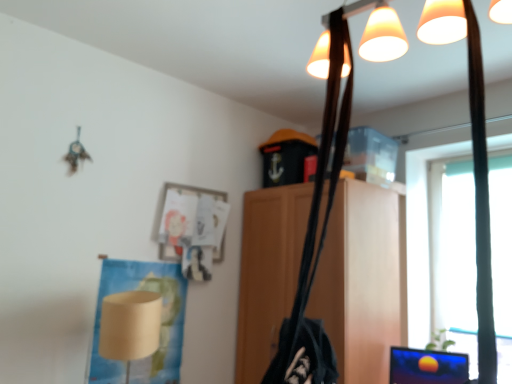
Question: Are wooden cabinet at center and transparent plastic window screen at right located far from each other?

Choices:
 (A) no
 (B) yes

Answer: (A)

Question: Is wooden cabinet at center to the left of transparent plastic window screen at right from the viewer's perspective?

Choices:
 (A) yes
 (B) no

Answer: (A)

Question: From a real-world perspective, does wooden cabinet at center stand above transparent plastic window screen at right?

Choices:
 (A) yes
 (B) no

Answer: (B)

Question: Is wooden cabinet at center located outside transparent plastic window screen at right?

Choices:
 (A) no
 (B) yes

Answer: (B)

Question: From the image's perspective, would you say wooden cabinet at center is positioned over transparent plastic window screen at right?

Choices:
 (A) no
 (B) yes

Answer: (A)

Question: Looking at the image, does beige paper lampshade at lower left seem bigger or smaller compared to transparent plastic window screen at right?

Choices:
 (A) big
 (B) small

Answer: (A)

Question: Is beige paper lampshade at lower left to the left or to the right of transparent plastic window screen at right in the image?

Choices:
 (A) left
 (B) right

Answer: (A)

Question: Choose the correct answer: Is beige paper lampshade at lower left inside transparent plastic window screen at right or outside it?

Choices:
 (A) outside
 (B) inside

Answer: (A)

Question: Is beige paper lampshade at lower left in front of or behind transparent plastic window screen at right in the image?

Choices:
 (A) behind
 (B) front

Answer: (B)

Question: Visually, is wooden cabinet at center positioned to the left or to the right of transparent plastic window screen at right?

Choices:
 (A) right
 (B) left

Answer: (B)

Question: From the image's perspective, is wooden cabinet at center above or below transparent plastic window screen at right?

Choices:
 (A) above
 (B) below

Answer: (B)

Question: Relative to transparent plastic window screen at right, is wooden cabinet at center in front or behind?

Choices:
 (A) front
 (B) behind

Answer: (A)

Question: Choose the correct answer: Is wooden cabinet at center inside transparent plastic window screen at right or outside it?

Choices:
 (A) outside
 (B) inside

Answer: (A)

Question: Is point (357, 190) closer or farther from the camera than point (144, 352)?

Choices:
 (A) farther
 (B) closer

Answer: (A)

Question: In terms of height, does wooden cabinet at center look taller or shorter compared to beige paper lampshade at lower left?

Choices:
 (A) short
 (B) tall

Answer: (B)